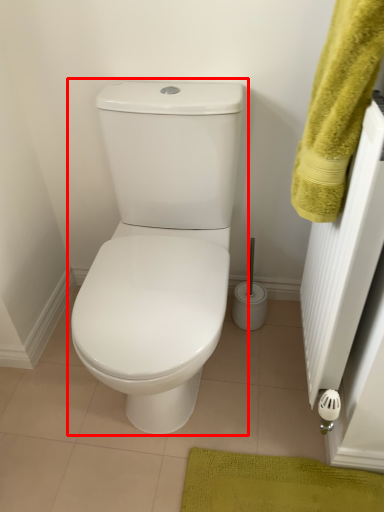
Question: From the image's perspective, what is the correct spatial relationship of toilet (annotated by the red box) in relation to bath towel?

Choices:
 (A) below
 (B) above

Answer: (A)